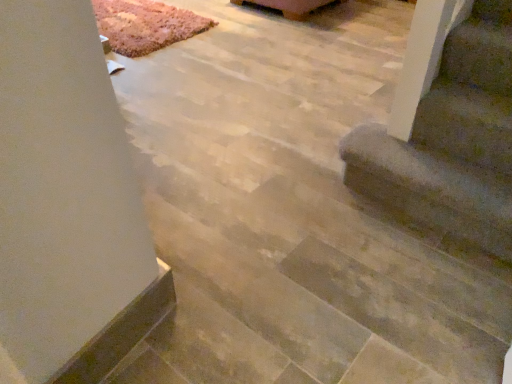
Question: Is brown fuzzy carpet at lower right outside rug carpet at upper left?

Choices:
 (A) no
 (B) yes

Answer: (B)

Question: Can you confirm if brown fuzzy carpet at lower right is taller than rug carpet at upper left?

Choices:
 (A) no
 (B) yes

Answer: (B)

Question: Is brown fuzzy carpet at lower right at the right side of rug carpet at upper left?

Choices:
 (A) yes
 (B) no

Answer: (A)

Question: Does brown fuzzy carpet at lower right appear on the left side of rug carpet at upper left?

Choices:
 (A) yes
 (B) no

Answer: (B)

Question: Are brown fuzzy carpet at lower right and rug carpet at upper left located far from each other?

Choices:
 (A) no
 (B) yes

Answer: (B)

Question: From their relative heights in the image, would you say brown fuzzy carpet at lower right is taller or shorter than rug carpet at upper left?

Choices:
 (A) tall
 (B) short

Answer: (A)

Question: Does point (462, 129) appear closer or farther from the camera than point (117, 34)?

Choices:
 (A) farther
 (B) closer

Answer: (B)

Question: Is brown fuzzy carpet at lower right situated inside rug carpet at upper left or outside?

Choices:
 (A) inside
 (B) outside

Answer: (B)

Question: Would you say brown fuzzy carpet at lower right is to the left or to the right of rug carpet at upper left in the picture?

Choices:
 (A) left
 (B) right

Answer: (B)

Question: Is brown fuzzy carpet at lower right to the left or to the right of wooden coffee table at upper center in the image?

Choices:
 (A) left
 (B) right

Answer: (B)

Question: Is brown fuzzy carpet at lower right wider or thinner than wooden coffee table at upper center?

Choices:
 (A) wide
 (B) thin

Answer: (B)

Question: Considering the positions of point (462, 130) and point (310, 8), is point (462, 130) closer or farther from the camera than point (310, 8)?

Choices:
 (A) closer
 (B) farther

Answer: (A)

Question: Is brown fuzzy carpet at lower right spatially inside wooden coffee table at upper center, or outside of it?

Choices:
 (A) outside
 (B) inside

Answer: (A)

Question: From a real-world perspective, relative to wooden coffee table at upper center, is rug carpet at upper left vertically above or below?

Choices:
 (A) above
 (B) below

Answer: (B)

Question: From the image's perspective, is rug carpet at upper left positioned above or below wooden coffee table at upper center?

Choices:
 (A) above
 (B) below

Answer: (B)